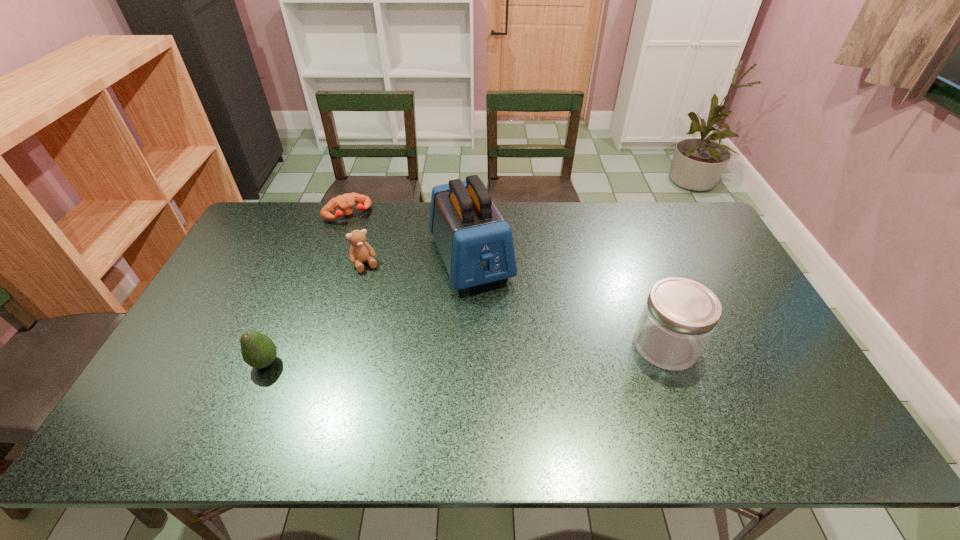
The image size is (960, 540). What are the coordinates of `vacant space located on the front-facing side of the teddy bear` in the screenshot? It's located at (381, 298).

You are a GUI agent. You are given a task and a screenshot of the screen. Output one action in this format:
    pyautogui.click(x=<x>, y=<y>)
    Task: Click on the free space located on the front-facing side of the teddy bear
    
    Given the screenshot: What is the action you would take?
    pyautogui.click(x=386, y=309)

Locate an element on the screen. This screenshot has width=960, height=540. vacant area situated 0.360m on the front-facing side of the tallest object is located at coordinates (534, 398).

Locate an element on the screen. vacant space located 0.290m on the front-facing side of the tallest object is located at coordinates (522, 375).

Identify the location of free space located on the front-facing side of the tallest object. (496, 320).

Identify the location of vacant space located 0.390m with the gloves of the puncher facing forward. The height and width of the screenshot is (540, 960). (399, 291).

At what (x,y) coordinates should I click in order to perform the action: click on vacant space located with the gloves of the puncher facing forward. Please return your answer as a coordinate pair (x, y). This screenshot has width=960, height=540. Looking at the image, I should click on (369, 243).

At what (x,y) coordinates should I click in order to perform the action: click on vacant space situated 0.150m with the gloves of the puncher facing forward. Please return your answer as a coordinate pair (x, y). The height and width of the screenshot is (540, 960). Looking at the image, I should click on (371, 246).

Find the location of a particular element. This screenshot has height=540, width=960. toaster present at the far edge is located at coordinates (476, 244).

At what (x,y) coordinates should I click in order to perform the action: click on puncher located at the far edge. Please return your answer as a coordinate pair (x, y). The width and height of the screenshot is (960, 540). Looking at the image, I should click on (345, 202).